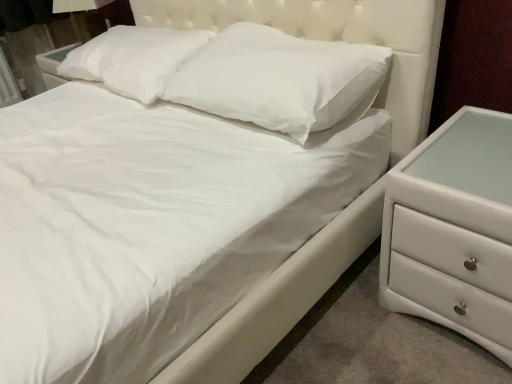
Question: Is white soft pillow at upper center, acting as the 1th pillow starting from the left, at the left side of white soft pillow at center, positioned as the 2th pillow in left-to-right order?

Choices:
 (A) yes
 (B) no

Answer: (A)

Question: From a real-world perspective, is white soft pillow at upper center, acting as the 1th pillow starting from the left, positioned over white soft pillow at center, the first pillow when ordered from right to left, based on gravity?

Choices:
 (A) no
 (B) yes

Answer: (A)

Question: Can you confirm if white soft pillow at upper center, acting as the 1th pillow starting from the left, is taller than white soft pillow at center, the first pillow when ordered from right to left?

Choices:
 (A) no
 (B) yes

Answer: (A)

Question: Is white soft pillow at center, the first pillow when ordered from right to left, inside white soft pillow at upper center, acting as the 1th pillow starting from the left?

Choices:
 (A) yes
 (B) no

Answer: (B)

Question: From a real-world perspective, is white soft pillow at upper center, acting as the second pillow starting from the right, positioned under white soft pillow at center, the first pillow when ordered from right to left, based on gravity?

Choices:
 (A) yes
 (B) no

Answer: (A)

Question: Considering the positions of white glossy chest of drawers at right and white soft pillow at upper center, acting as the 1th pillow starting from the left, in the image, is white glossy chest of drawers at right bigger or smaller than white soft pillow at upper center, acting as the 1th pillow starting from the left,?

Choices:
 (A) small
 (B) big

Answer: (B)

Question: Looking at their shapes, would you say white glossy chest of drawers at right is wider or thinner than white soft pillow at upper center, acting as the second pillow starting from the right?

Choices:
 (A) thin
 (B) wide

Answer: (B)

Question: In the image, is white glossy chest of drawers at right positioned in front of or behind white soft pillow at upper center, acting as the second pillow starting from the right?

Choices:
 (A) behind
 (B) front

Answer: (B)

Question: From a real-world perspective, relative to white soft pillow at upper center, acting as the 1th pillow starting from the left, is white glossy chest of drawers at right vertically above or below?

Choices:
 (A) below
 (B) above

Answer: (A)

Question: Looking at their shapes, would you say white soft pillow at upper center, acting as the second pillow starting from the right, is wider or thinner than white glossy chest of drawers at right?

Choices:
 (A) thin
 (B) wide

Answer: (A)

Question: In terms of size, does white soft pillow at upper center, acting as the 1th pillow starting from the left, appear bigger or smaller than white glossy chest of drawers at right?

Choices:
 (A) big
 (B) small

Answer: (B)

Question: Does point (156, 67) appear closer or farther from the camera than point (478, 256)?

Choices:
 (A) farther
 (B) closer

Answer: (A)

Question: Relative to white glossy chest of drawers at right, is white soft pillow at upper center, acting as the 1th pillow starting from the left, in front or behind?

Choices:
 (A) behind
 (B) front

Answer: (A)

Question: Is white soft pillow at center, the first pillow when ordered from right to left, inside the boundaries of white glossy chest of drawers at right, or outside?

Choices:
 (A) outside
 (B) inside

Answer: (A)

Question: Considering the positions of white soft pillow at center, positioned as the 2th pillow in left-to-right order, and white glossy chest of drawers at right in the image, is white soft pillow at center, positioned as the 2th pillow in left-to-right order, wider or thinner than white glossy chest of drawers at right?

Choices:
 (A) thin
 (B) wide

Answer: (A)